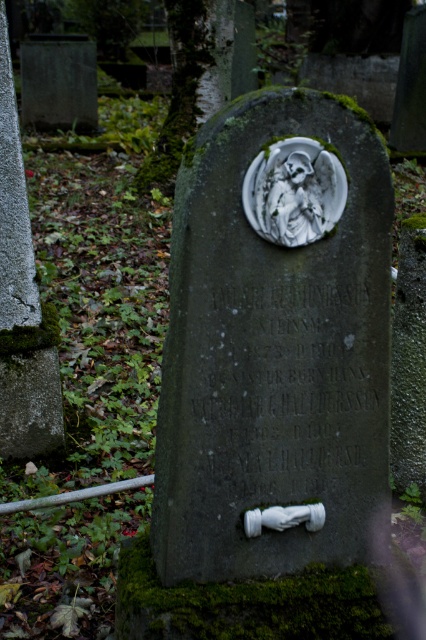
You are standing in front of the gravestone and notice a specific point marked at coordinates [275,340]. What is the object located at this point?

The green mossy stone at center is located at point [275,340].

You are visiting a cemetery and notice two objects at the center of the gravestone. One is the green mossy stone at center and the other is the white stone angel at center. Which one is taller?

The green mossy stone at center is taller than the white stone angel at center.

You are a visitor at the cemetery and want to place a bouquet of flowers between the green mossy stone at center and the white stone angel at center. Which object should you place the flowers closer to if you want them to be near the larger object?

The green mossy stone at center is larger in size than the white stone angel at center, so you should place the bouquet closer to the green mossy stone at center.